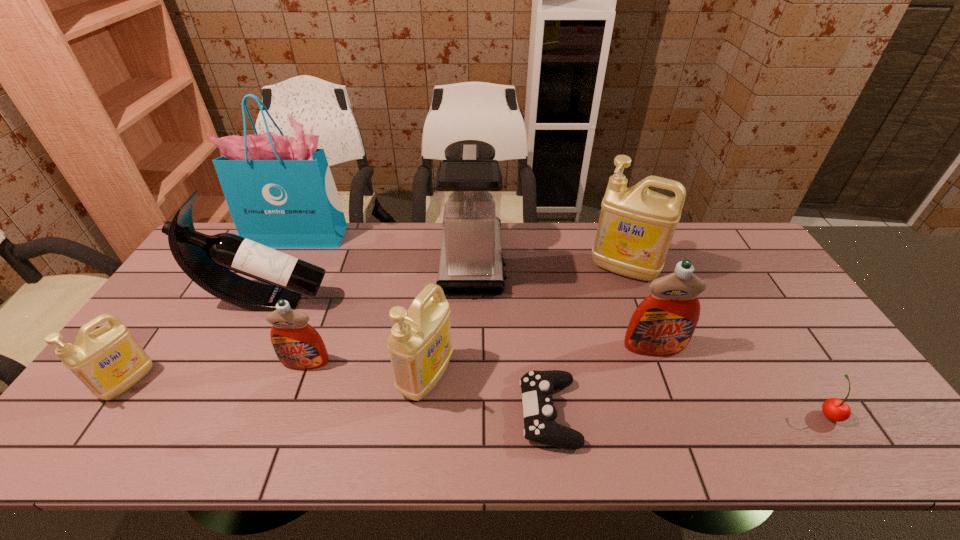
At what (x,y) coordinates should I click in order to perform the action: click on free space that satisfies the following two spatial constraints: 1. on the stand of the second beige detergent from left to right; 2. on the right side of the black wine bottle. Please return your answer as a coordinate pair (x, y). Looking at the image, I should click on (229, 377).